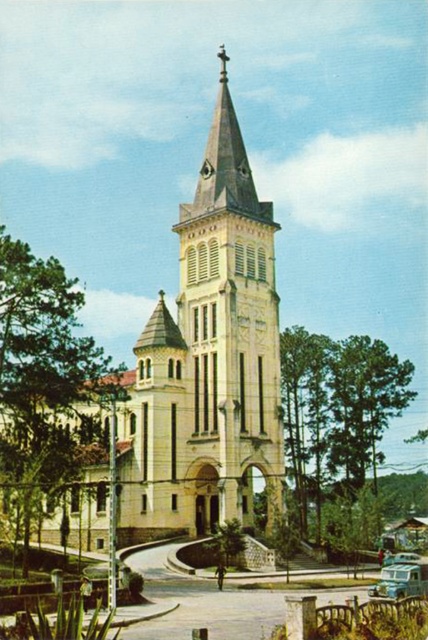
Question: Estimate the real-world distances between objects in this image. Which object is farther from the green leafy tree at lower right?

Choices:
 (A) metallic silver car at lower right
 (B) green leafy tree at left

Answer: (B)

Question: Among these points, which one is nearest to the camera?

Choices:
 (A) (392, 584)
 (B) (347, 401)

Answer: (A)

Question: Among these points, which one is farthest from the camera?

Choices:
 (A) (210, 547)
 (B) (392, 566)
 (C) (23, 298)

Answer: (B)

Question: Can you confirm if green leafy tree at left is positioned above metallic silver car at lower right?

Choices:
 (A) yes
 (B) no

Answer: (A)

Question: Is metallic silver car at lower right thinner than green leafy tree at center?

Choices:
 (A) no
 (B) yes

Answer: (A)

Question: Does metallic silver car at lower right appear on the left side of green leafy tree at center?

Choices:
 (A) yes
 (B) no

Answer: (B)